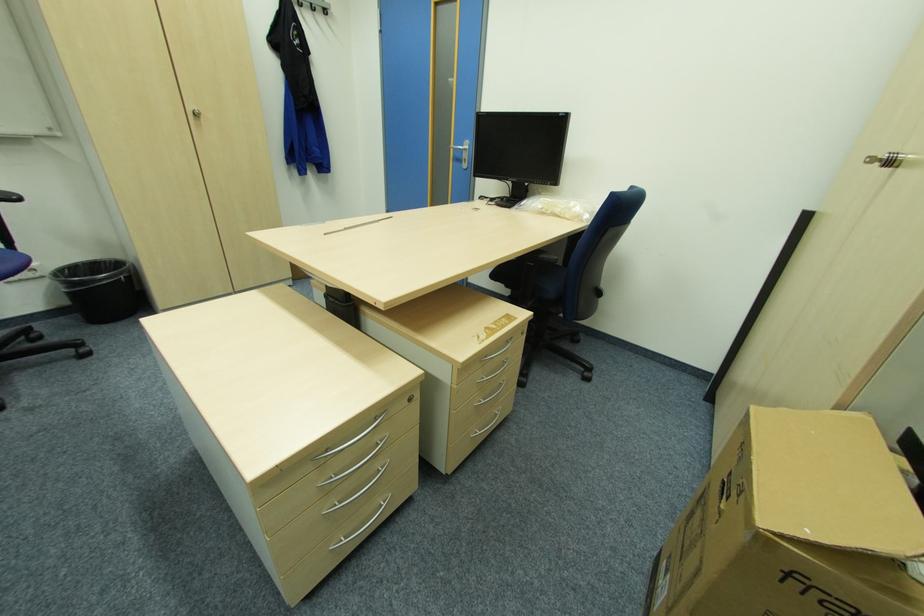
At what (x,y) coordinates should I click in order to perform the action: click on black trash can. Please return your answer as a coordinate pair (x, y). The height and width of the screenshot is (616, 924). Looking at the image, I should click on (99, 289).